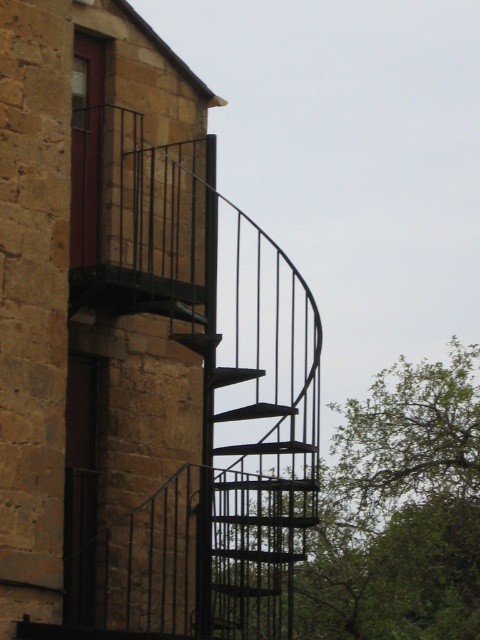
Is matte black staircase at upper right positioned before green leafy tree at right?

That is True.

Does matte black staircase at upper right have a greater height compared to green leafy tree at right?

Yes.

Who is more forward, [132,100] or [379,516]?

Positioned in front is point [132,100].

Identify the location of matte black staircase at upper right. The height and width of the screenshot is (640, 480). (85, 296).